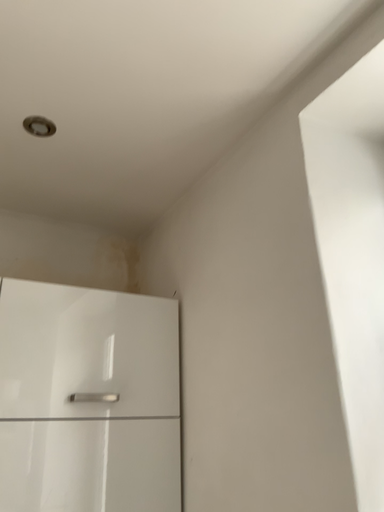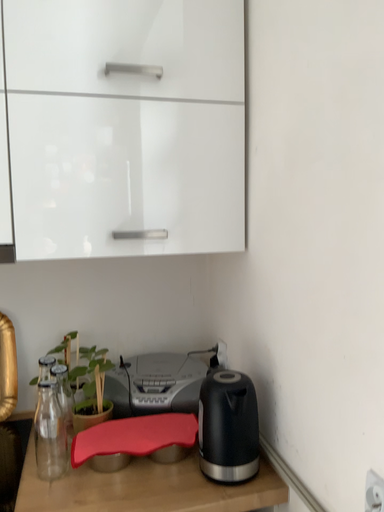
Question: Which way did the camera rotate in the video?

Choices:
 (A) rotated left
 (B) rotated right

Answer: (A)